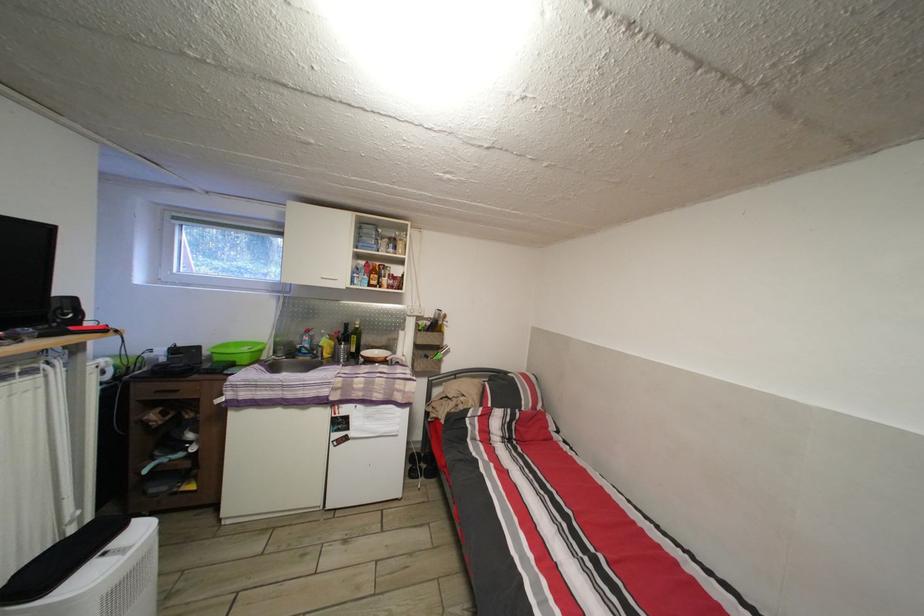
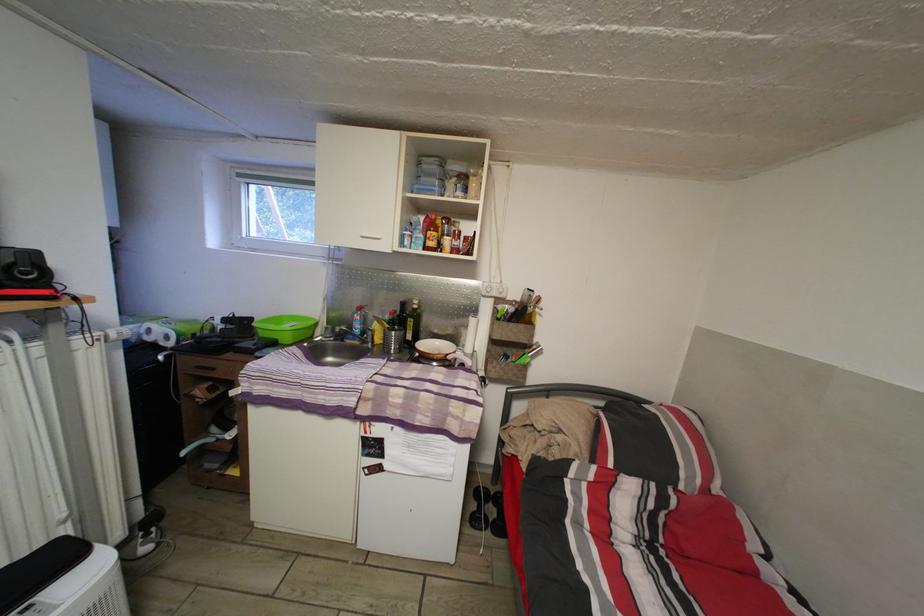
Question: What movement of the cameraman would produce the second image?

Choices:
 (A) Left
 (B) Right
 (C) Forward
 (D) Backward

Answer: (C)